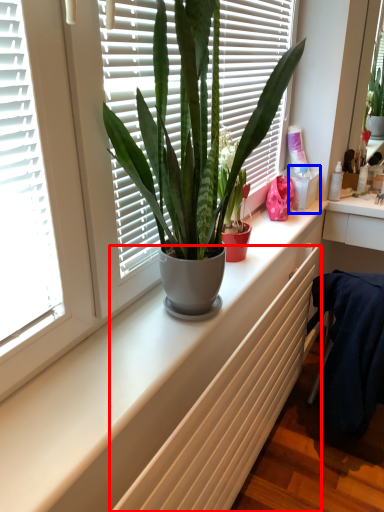
Question: Which object is further to the camera taking this photo, radiator (highlighted by a red box) or window box (highlighted by a blue box)?

Choices:
 (A) radiator
 (B) window box

Answer: (B)